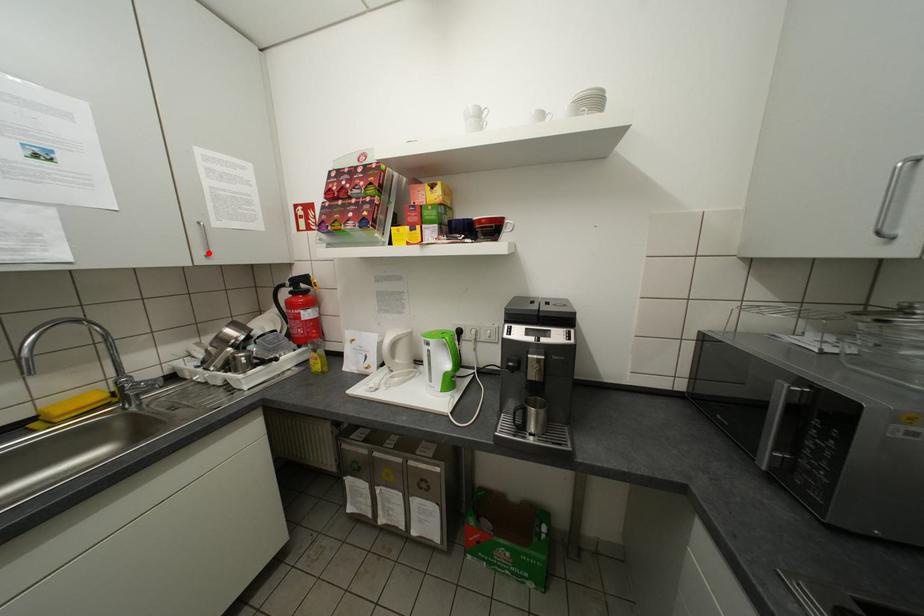
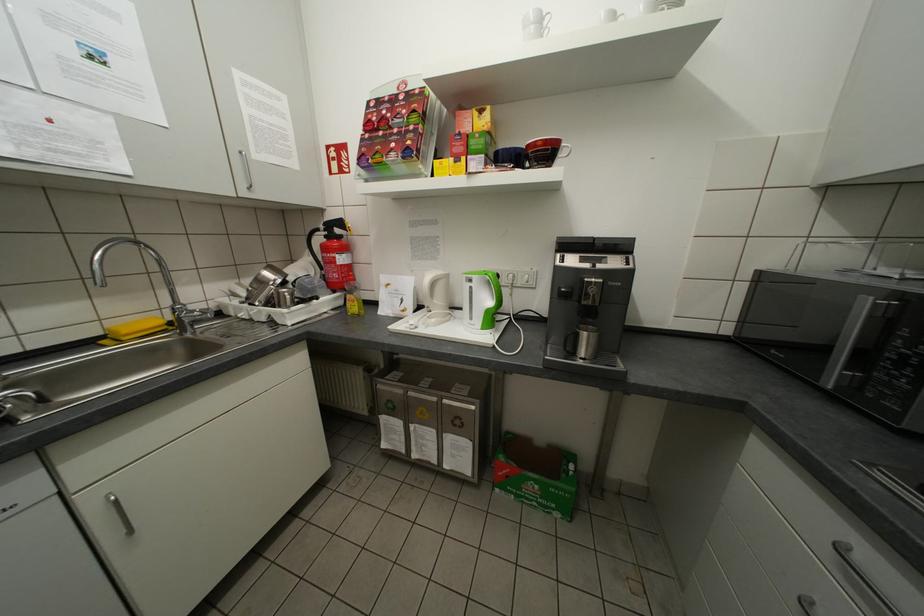
Where in the second image is the point corresponding to the highlighted location from the first image?

(251, 185)